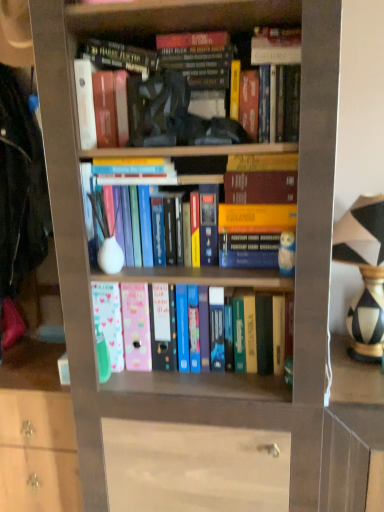
Question: In which direction should I rotate to look at hardcover book at upper center, which appears as the 2th book when ordered from the bottom?

Choices:
 (A) right
 (B) left

Answer: (B)

Question: Are pastel matte file folders at center, placed as the first book when sorted from bottom to top, and hardcover book at upper center, which is the 1th book in top-to-bottom order, far apart?

Choices:
 (A) yes
 (B) no

Answer: (B)

Question: From the image's perspective, is pastel matte file folders at center, placed as the first book when sorted from bottom to top, beneath hardcover book at upper center, which ranks as the third book in bottom-to-top order?

Choices:
 (A) yes
 (B) no

Answer: (A)

Question: Considering the relative sizes of pastel matte file folders at center, arranged as the 3th book when viewed from the top, and hardcover book at upper center, which is the 1th book in top-to-bottom order, in the image provided, is pastel matte file folders at center, arranged as the 3th book when viewed from the top, thinner than hardcover book at upper center, which is the 1th book in top-to-bottom order,?

Choices:
 (A) no
 (B) yes

Answer: (A)

Question: Is pastel matte file folders at center, arranged as the 3th book when viewed from the top, located outside hardcover book at upper center, which is the 1th book in top-to-bottom order?

Choices:
 (A) yes
 (B) no

Answer: (A)

Question: Considering the relative sizes of pastel matte file folders at center, placed as the first book when sorted from bottom to top, and hardcover book at upper center, which is the 1th book in top-to-bottom order, in the image provided, is pastel matte file folders at center, placed as the first book when sorted from bottom to top, wider than hardcover book at upper center, which is the 1th book in top-to-bottom order,?

Choices:
 (A) yes
 (B) no

Answer: (A)

Question: Is pastel matte file folders at center, arranged as the 3th book when viewed from the top, behind hardcover book at upper center, which ranks as the third book in bottom-to-top order?

Choices:
 (A) yes
 (B) no

Answer: (A)

Question: Can you confirm if black-and-white striped vase at right is shorter than hardcover book at upper center, which is the 2th book from top to bottom?

Choices:
 (A) no
 (B) yes

Answer: (A)

Question: From a real-world perspective, is black-and-white striped vase at right located higher than hardcover book at upper center, which is the 2th book from top to bottom?

Choices:
 (A) no
 (B) yes

Answer: (A)

Question: Does black-and-white striped vase at right appear on the right side of hardcover book at upper center, which appears as the 2th book when ordered from the bottom?

Choices:
 (A) no
 (B) yes

Answer: (B)

Question: From the image's perspective, would you say black-and-white striped vase at right is shown under hardcover book at upper center, which appears as the 2th book when ordered from the bottom?

Choices:
 (A) yes
 (B) no

Answer: (A)

Question: Is black-and-white striped vase at right looking in the opposite direction of hardcover book at upper center, which is the 2th book from top to bottom?

Choices:
 (A) no
 (B) yes

Answer: (A)

Question: Is black-and-white striped vase at right at the left side of hardcover book at upper center, which appears as the 2th book when ordered from the bottom?

Choices:
 (A) yes
 (B) no

Answer: (B)

Question: From a real-world perspective, is hardcover book at upper center, which appears as the 2th book when ordered from the bottom, physically below black-and-white striped vase at right?

Choices:
 (A) no
 (B) yes

Answer: (A)